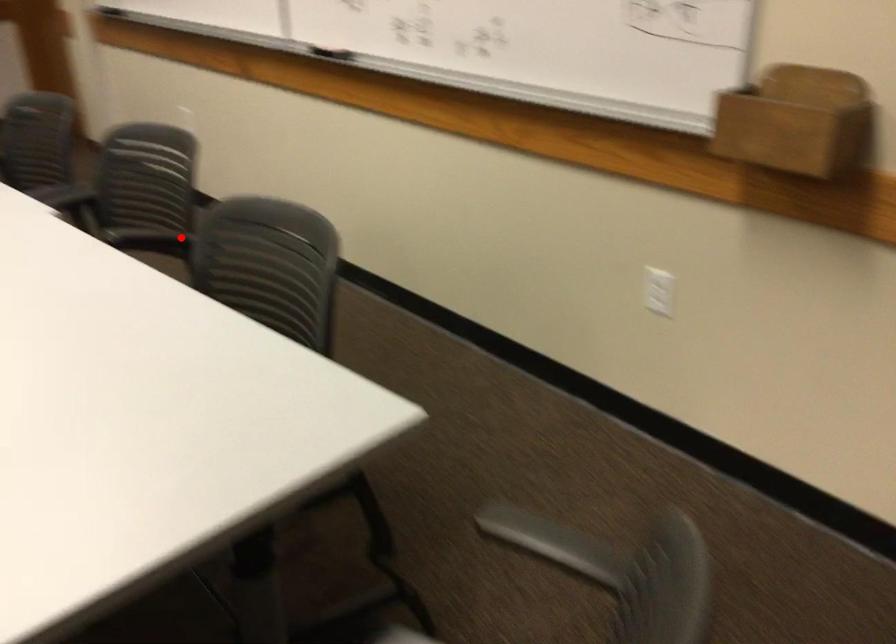
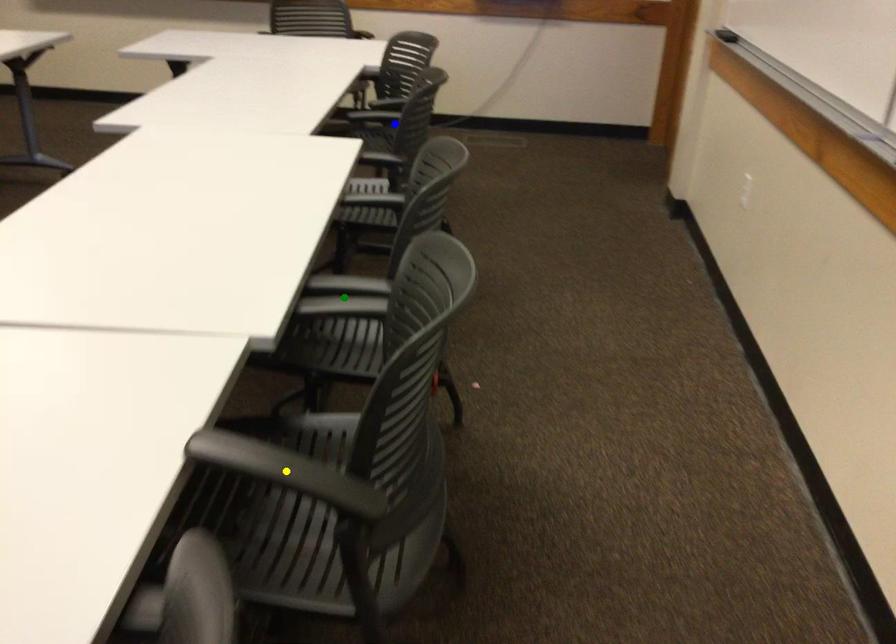
Question: I am providing you with two images of the same scene from different viewpoints. A red point is marked on the first image. You are given multiple points on the second image. Which mark in image 2 goes with the point in image 1?

Choices:
 (A) blue point
 (B) yellow point
 (C) green point

Answer: (B)